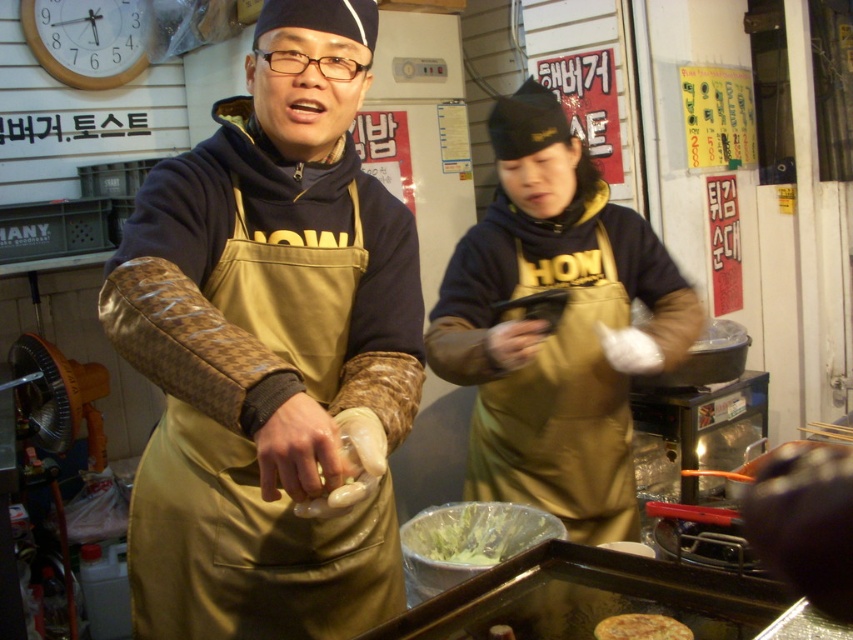
Question: Is brown leather apron at center to the right of golden crispy pancake at center from the viewer's perspective?

Choices:
 (A) yes
 (B) no

Answer: (B)

Question: Which of the following is the closest to the observer?

Choices:
 (A) brown leather apron at center
 (B) gold leather apron at center

Answer: (A)

Question: From the image, what is the correct spatial relationship of green leafy vegetables in plastic bag at center in relation to golden crispy pancake at center?

Choices:
 (A) below
 (B) above

Answer: (B)

Question: Which object appears closest to the camera in this image?

Choices:
 (A) golden crispy pancake at center
 (B) green leafy vegetables in plastic bag at center

Answer: (A)

Question: Considering the real-world distances, which object is farthest from the brown leather apron at center?

Choices:
 (A) golden crispy pancake at center
 (B) green leafy vegetables in plastic bag at center

Answer: (A)

Question: Can you confirm if brown leather apron at center is wider than golden crispy pancake at center?

Choices:
 (A) yes
 (B) no

Answer: (A)